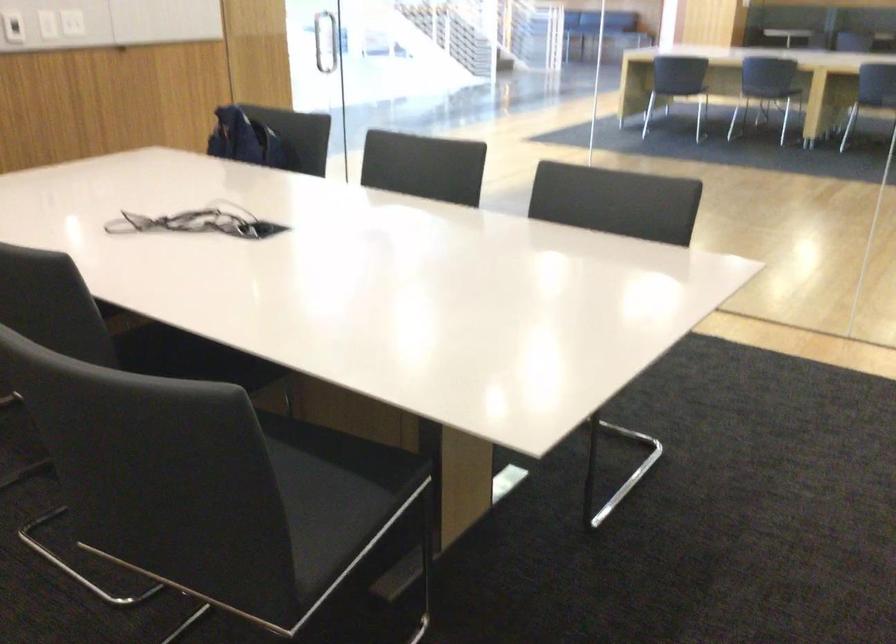
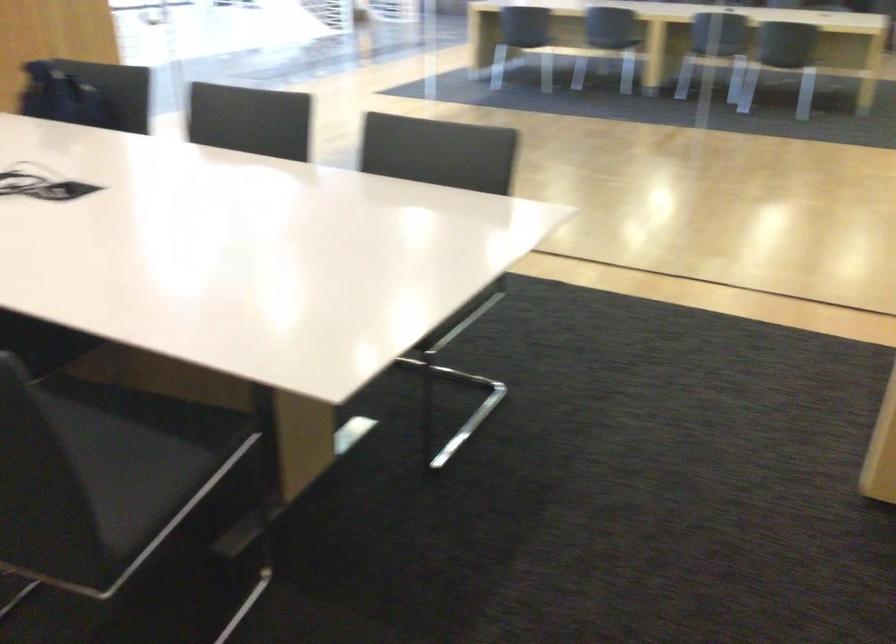
Question: The camera is either moving clockwise (left) or counter-clockwise (right) around the object. The first image is from the beginning of the video and the second image is from the end. Is the camera moving left or right when shooting the video?

Choices:
 (A) Left
 (B) Right

Answer: (A)